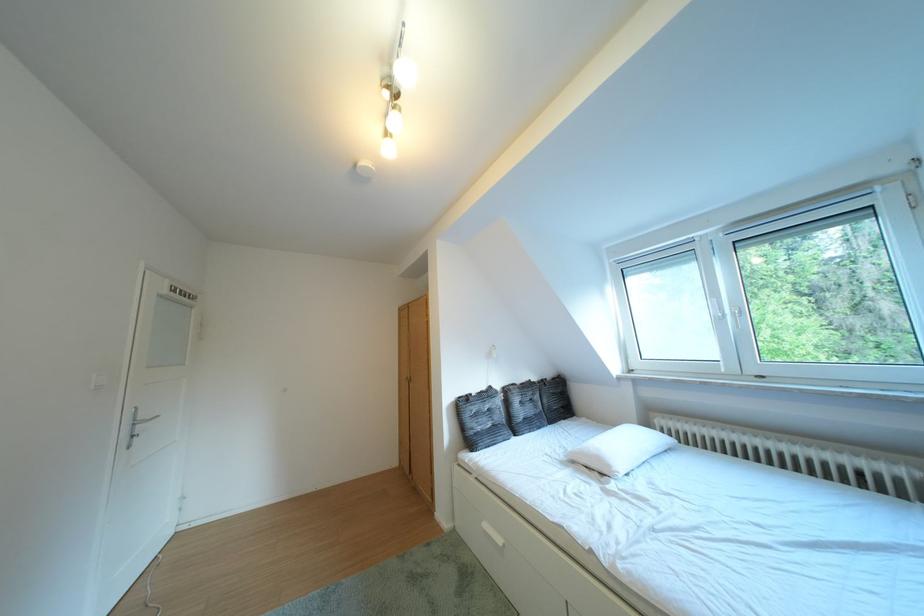
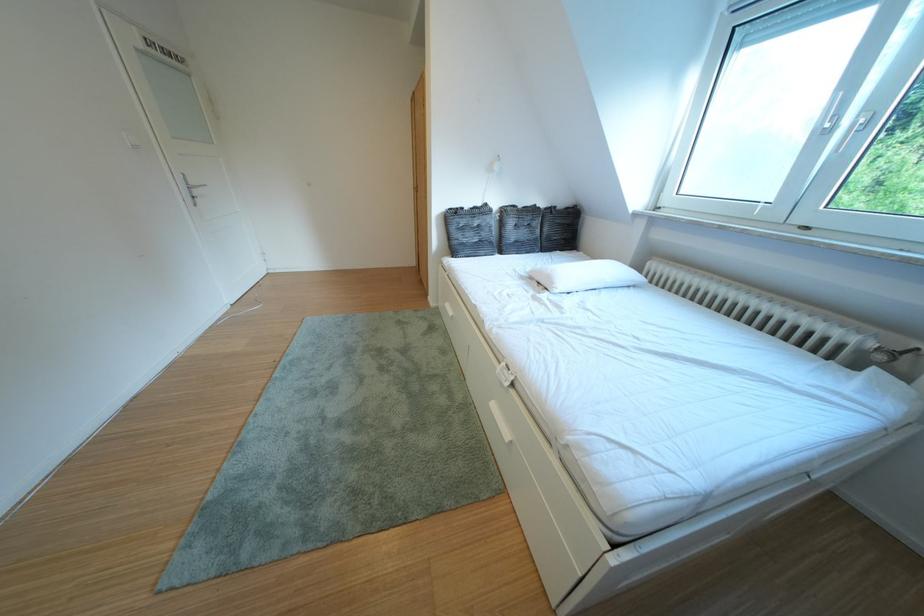
Question: How did the camera likely rotate?

Choices:
 (A) Left
 (B) Right
 (C) Up
 (D) Down

Answer: (D)